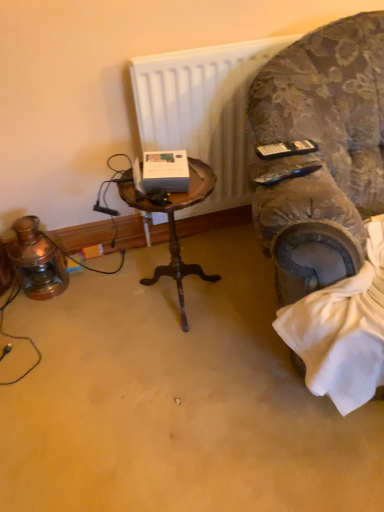
At what (x,y) coordinates should I click in order to perform the action: click on vacant space behind woodenobject at center. Please return your answer as a coordinate pair (x, y). The image size is (384, 512). Looking at the image, I should click on (181, 257).